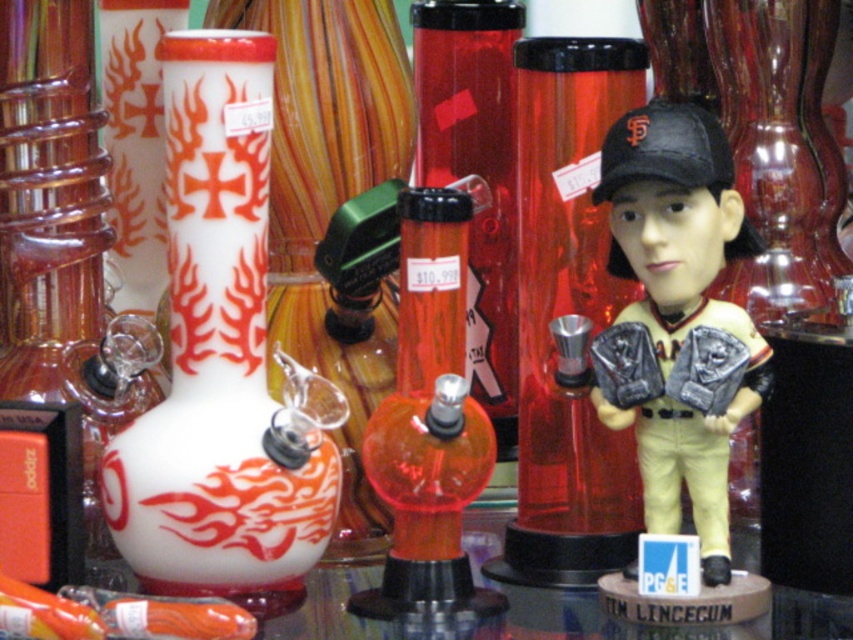
Can you confirm if translucent orange glass bong at center is wider than translucent amber glass vase at center?

No, translucent orange glass bong at center is not wider than translucent amber glass vase at center.

Can you confirm if translucent orange glass bong at center is shorter than translucent amber glass vase at center?

In fact, translucent orange glass bong at center may be taller than translucent amber glass vase at center.

Identify the location of translucent orange glass bong at center. This screenshot has height=640, width=853. (428, 422).

Is white glossy bong at left further to the viewer compared to translucent orange glass bong at center?

That is False.

Who is more forward, (186, 401) or (399, 227)?

Positioned in front is point (186, 401).

This screenshot has height=640, width=853. I want to click on white glossy bong at left, so click(x=219, y=360).

Does white glossy bong at left have a lesser height compared to translucent amber glass vase at center?

No, white glossy bong at left is not shorter than translucent amber glass vase at center.

Is point (177, 438) behind point (822, 220)?

No, it is not.

Find the location of `white glossy bong at left`. white glossy bong at left is located at coordinates (219, 360).